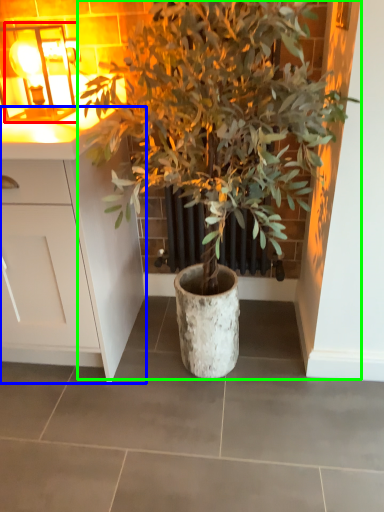
Question: Considering the real-world distances, which object is closest to light fixture (highlighted by a red box)? cabinetry (highlighted by a blue box) or houseplant (highlighted by a green box).

Choices:
 (A) cabinetry
 (B) houseplant

Answer: (A)